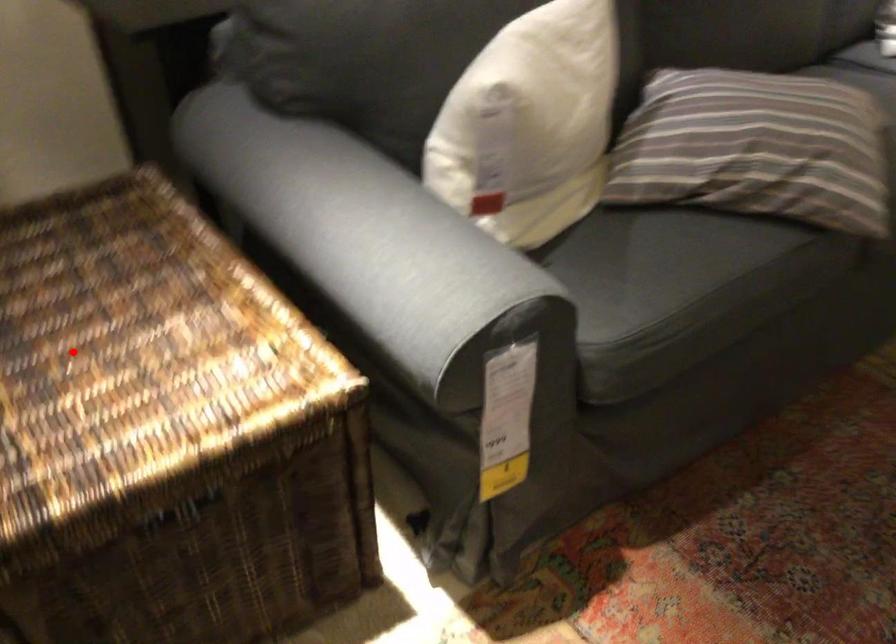
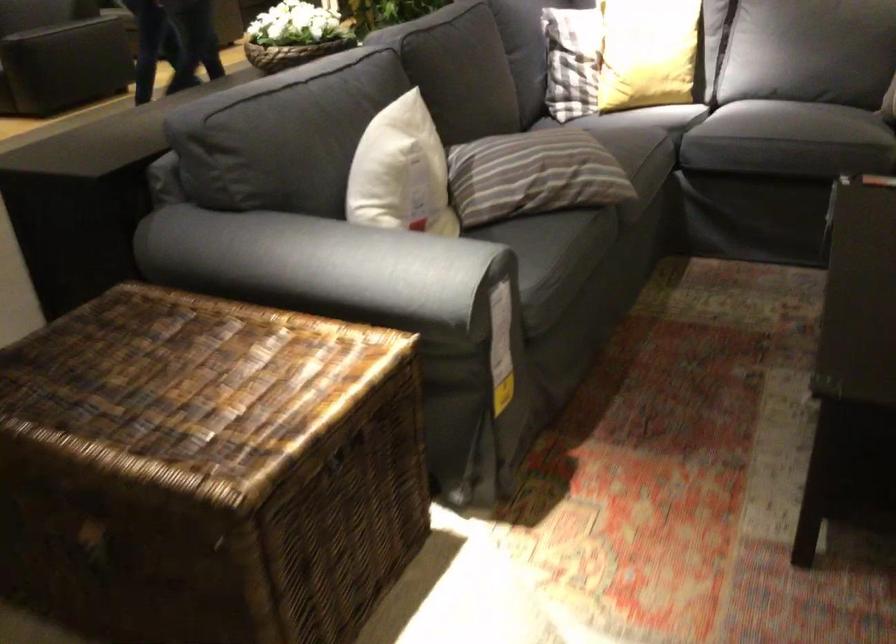
Question: A red point is marked in image1. In image2, is the corresponding 3D point closer to the camera or farther? Reply with the corresponding letter.

Choices:
 (A) The corresponding 3D point is closer.
 (B) The corresponding 3D point is farther.

Answer: (B)